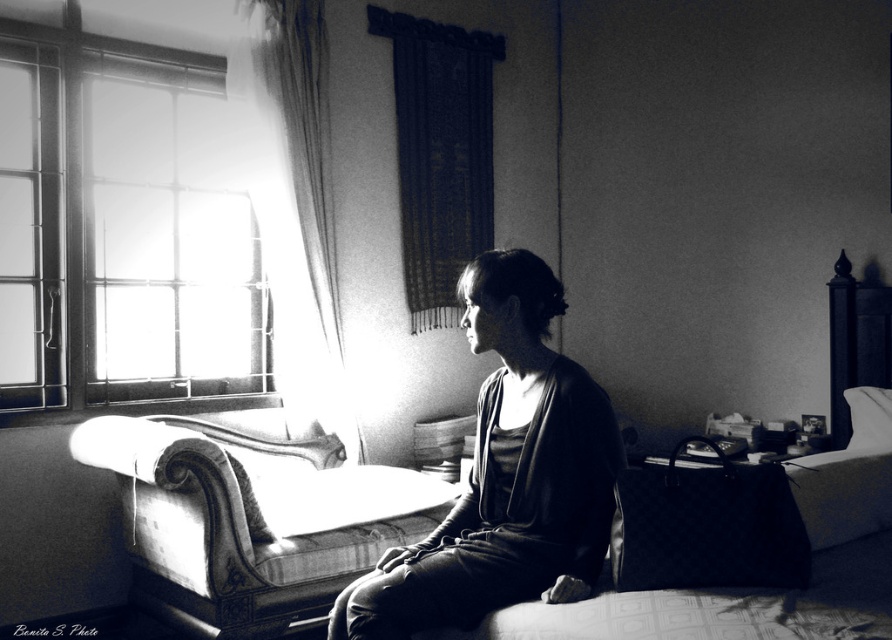
Question: Which of the following is the closest to the observer?

Choices:
 (A) (253, 445)
 (B) (857, 433)
 (C) (500, 416)

Answer: (C)

Question: Is glass pane window at upper left closer to camera compared to velvet-like fabric couch at center?

Choices:
 (A) no
 (B) yes

Answer: (A)

Question: Among these objects, which one is farthest from the camera?

Choices:
 (A) glass pane window at upper left
 (B) soft white pillow at upper right

Answer: (A)

Question: Does glass pane window at upper left appear on the right side of velvet-like fabric couch at center?

Choices:
 (A) no
 (B) yes

Answer: (A)

Question: Which of the following is the farthest from the observer?

Choices:
 (A) glass pane window at upper left
 (B) soft white pillow at upper right
 (C) soft fabric bed at center
 (D) smooth fabric shirt at center

Answer: (A)

Question: Is glass pane window at upper left smaller than soft white pillow at upper right?

Choices:
 (A) yes
 (B) no

Answer: (B)